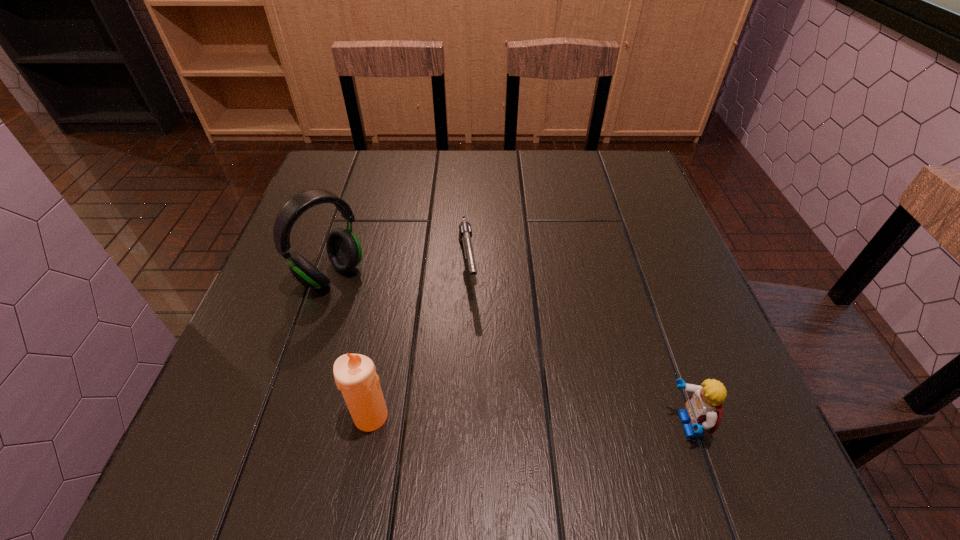
Locate an element on the screen. This screenshot has width=960, height=540. free space on the desktop that is between the candle and the rightmost object and is positioned on the ear cups of the leftmost object is located at coordinates (501, 420).

What are the coordinates of `vacant spot on the desktop that is between the third object from right to left and the third tallest object and is positioned aiming along the barrel of the shortest object` in the screenshot? It's located at (493, 420).